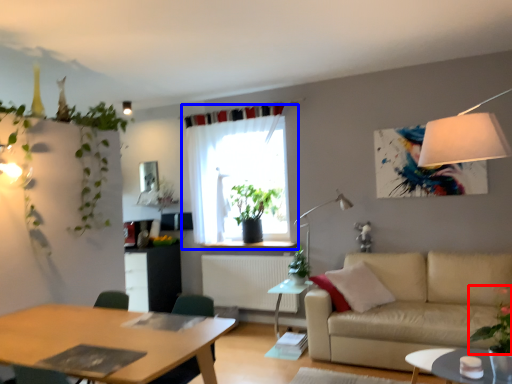
Question: Which object appears farthest to the camera in this image, plant (highlighted by a red box) or curtain (highlighted by a blue box)?

Choices:
 (A) plant
 (B) curtain

Answer: (B)